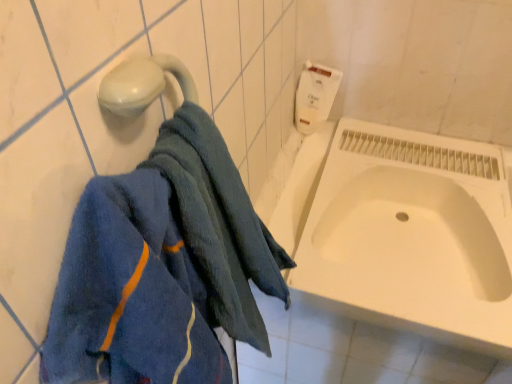
Question: From the image's perspective, is white matte toilet paper at upper right above or below white glossy bathtub at center?

Choices:
 (A) below
 (B) above

Answer: (B)

Question: Considering the positions of white matte toilet paper at upper right and white glossy bathtub at center in the image, is white matte toilet paper at upper right bigger or smaller than white glossy bathtub at center?

Choices:
 (A) big
 (B) small

Answer: (B)

Question: Based on their relative distances, which object is farther from the blue soft towel at left?

Choices:
 (A) white matte toilet paper at upper right
 (B) white glossy bathtub at center

Answer: (A)

Question: Estimate the real-world distances between objects in this image. Which object is closer to the white matte toilet paper at upper right?

Choices:
 (A) blue soft towel at left
 (B) white glossy bathtub at center

Answer: (B)